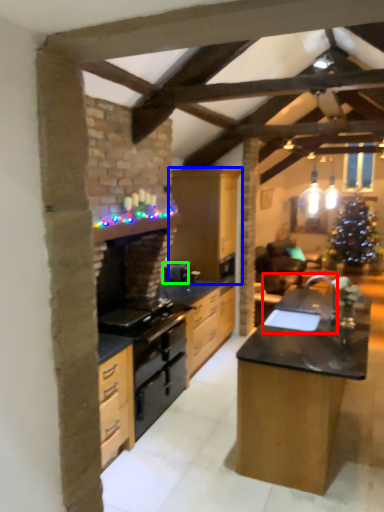
Question: Considering the real-world distances, which object is closest to sink (highlighted by a red box)? cabinetry (highlighted by a blue box) or appliance (highlighted by a green box).

Choices:
 (A) cabinetry
 (B) appliance

Answer: (A)